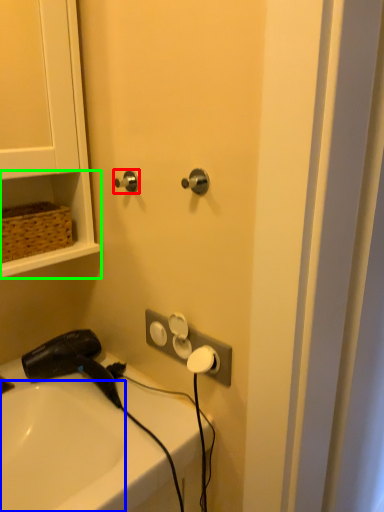
Question: Considering the real-world distances, which object is farthest from door handle (highlighted by a red box)? sink (highlighted by a blue box) or shelf (highlighted by a green box)?

Choices:
 (A) sink
 (B) shelf

Answer: (A)